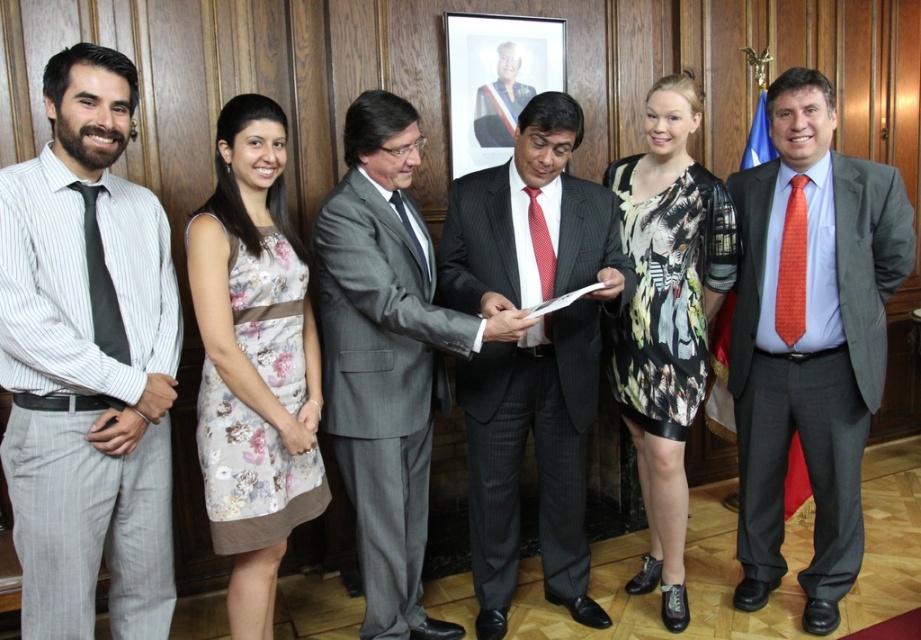
You are organizing a charity event and need to decide which tie to use for the auction. The orange dotted tie at right and the matte black tie at center are both options. Based on their sizes, which one would you choose if you want the larger one?

The orange dotted tie at right is bigger than the matte black tie at center, so you should choose the orange dotted tie at right for the auction if you want the larger one.

You are a tailor who needs to determine which tie requires more fabric to make between the orange dotted tie at right and the matte black tie at center. Based on the image, which one would need more fabric?

The matte black tie at center requires more fabric because its width is greater than the orange dotted tie at right.

You are a photographer adjusting your camera settings to capture the group photo. You notice the orange dotted tie at right and the matte black tie at center. Which tie is positioned lower in the frame?

The orange dotted tie at right is below matte black tie at center, so it is positioned lower in the frame.